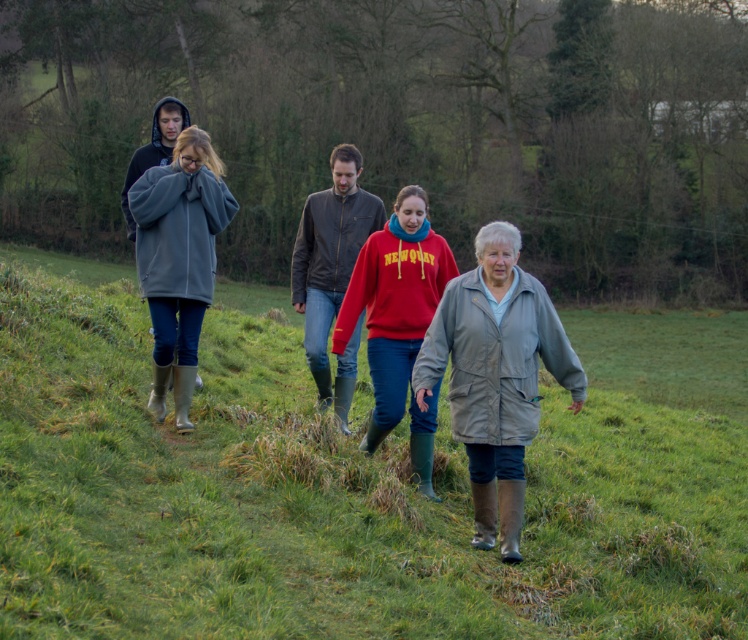
Which of these two, gray matte jacket at center or red fleece sweater at center, stands shorter?

gray matte jacket at center is shorter.

Is gray matte jacket at center above red fleece sweater at center?

Actually, gray matte jacket at center is below red fleece sweater at center.

Identify the location of gray matte jacket at center. Image resolution: width=748 pixels, height=640 pixels. (494, 376).

Image resolution: width=748 pixels, height=640 pixels. In order to click on gray matte jacket at center in this screenshot , I will do `click(494, 376)`.

Is the position of green rubber boots at center less distant than that of red fleece sweater at center?

Yes.

What do you see at coordinates (325, 493) in the screenshot? I see `green rubber boots at center` at bounding box center [325, 493].

At what (x,y) coordinates should I click in order to perform the action: click on green rubber boots at center. Please return your answer as a coordinate pair (x, y). The width and height of the screenshot is (748, 640). Looking at the image, I should click on (325, 493).

Does green rubber boots at center have a greater width compared to gray fleece jacket at center?

Yes.

Is green rubber boots at center to the right of gray fleece jacket at center from the viewer's perspective?

Yes, green rubber boots at center is to the right of gray fleece jacket at center.

Is point (631, 477) behind point (135, 248)?

No, it is in front of (135, 248).

The image size is (748, 640). I want to click on green rubber boots at center, so click(325, 493).